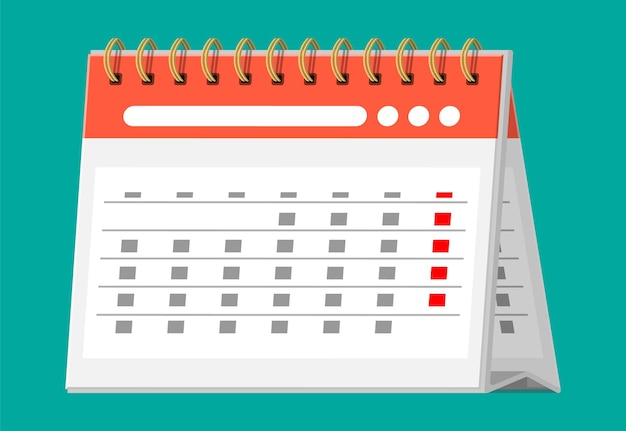
You are a GUI agent. You are given a task and a screenshot of the screen. Output one action in this format:
    pyautogui.click(x=<x>, y=<y>)
    Task: Click on the boxes in the 5th row from the top
    
    Given the screenshot: What is the action you would take?
    pyautogui.click(x=125, y=301), pyautogui.click(x=173, y=299), pyautogui.click(x=230, y=299), pyautogui.click(x=282, y=299), pyautogui.click(x=331, y=300), pyautogui.click(x=382, y=299), pyautogui.click(x=436, y=299)